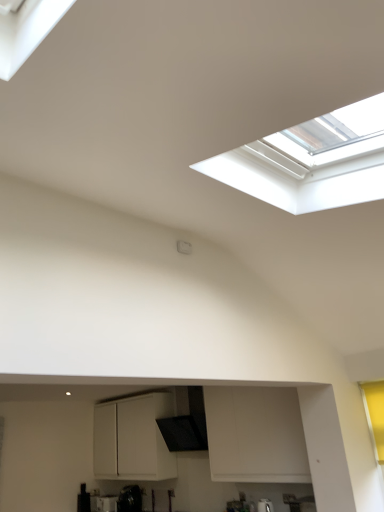
What do you see at coordinates (186, 425) in the screenshot?
I see `black textured exhaust hood at center` at bounding box center [186, 425].

Identify the location of black textured exhaust hood at center. This screenshot has height=512, width=384. (186, 425).

The height and width of the screenshot is (512, 384). What are the coordinates of `black glossy kettle at lower center` in the screenshot? It's located at (130, 499).

Measure the distance from black glossy kettle at lower center to black textured exhaust hood at center.

1.00 meters.

Could you tell me if black glossy kettle at lower center is facing black textured exhaust hood at center?

No, black glossy kettle at lower center is not turned towards black textured exhaust hood at center.

Which of these two, black glossy kettle at lower center or black textured exhaust hood at center, is wider?

black textured exhaust hood at center is wider.

Can you confirm if black glossy kettle at lower center is smaller than black textured exhaust hood at center?

Correct, black glossy kettle at lower center occupies less space than black textured exhaust hood at center.

Considering the sizes of objects white matte cabinet at center and black glossy kettle at lower center in the image provided, who is smaller, white matte cabinet at center or black glossy kettle at lower center?

With smaller size is black glossy kettle at lower center.

Find the location of a particular element. appliance behind the white matte cabinet at center is located at coordinates (130, 499).

Would you say white matte cabinet at center is outside black glossy kettle at lower center?

Yes, white matte cabinet at center is located beyond the bounds of black glossy kettle at lower center.

Could you tell me if black textured exhaust hood at center is turned towards white matte cabinet at center?

No, black textured exhaust hood at center does not turn towards white matte cabinet at center.

Is black textured exhaust hood at center completely or partially outside of white matte cabinet at center?

Indeed, black textured exhaust hood at center is completely outside white matte cabinet at center.

The width and height of the screenshot is (384, 512). Identify the location of cabinetry behind the black textured exhaust hood at center. (133, 439).

Does point (202, 420) lie behind point (135, 433)?

No, it is not.

Measure the distance between white matte cabinet at center and black textured exhaust hood at center.

A distance of 18.45 inches exists between white matte cabinet at center and black textured exhaust hood at center.

Considering the sizes of objects white matte cabinet at center and black textured exhaust hood at center in the image provided, who is thinner, white matte cabinet at center or black textured exhaust hood at center?

black textured exhaust hood at center is thinner.

From the image's perspective, between white matte cabinet at center and black textured exhaust hood at center, who is located below?

white matte cabinet at center.

In terms of size, does white matte cabinet at center appear bigger or smaller than black textured exhaust hood at center?

In the image, white matte cabinet at center appears to be larger than black textured exhaust hood at center.

Which object is thinner, black glossy kettle at lower center or white matte cabinet at center?

black glossy kettle at lower center.

Is black glossy kettle at lower center positioned behind white matte cabinet at center?

Yes, black glossy kettle at lower center is behind white matte cabinet at center.

Is white matte cabinet at center inside black glossy kettle at lower center?

Actually, white matte cabinet at center is outside black glossy kettle at lower center.

Is point (129, 490) farther from camera compared to point (128, 456)?

That is False.

Between black textured exhaust hood at center and black glossy kettle at lower center, which one is positioned behind?

black glossy kettle at lower center.

Consider the image. From the image's perspective, between black textured exhaust hood at center and black glossy kettle at lower center, which one is located above?

black textured exhaust hood at center appears higher in the image.

Considering the sizes of black textured exhaust hood at center and black glossy kettle at lower center in the image, is black textured exhaust hood at center wider or thinner than black glossy kettle at lower center?

black textured exhaust hood at center is wider than black glossy kettle at lower center.

The image size is (384, 512). I want to click on exhaust hood that appears above the black glossy kettle at lower center (from the image's perspective), so click(186, 425).

Locate an element on the screen. appliance below the white matte cabinet at center (from a real-world perspective) is located at coordinates (130, 499).

Estimate the real-world distances between objects in this image. Which object is closer to black textured exhaust hood at center, white matte cabinet at center or black glossy kettle at lower center?

The object closer to black textured exhaust hood at center is white matte cabinet at center.

When comparing their distances from black textured exhaust hood at center, does black glossy kettle at lower center or white matte cabinet at center seem further?

black glossy kettle at lower center is further to black textured exhaust hood at center.

Estimate the real-world distances between objects in this image. Which object is further from black glossy kettle at lower center, black textured exhaust hood at center or white matte cabinet at center?

Among the two, black textured exhaust hood at center is located further to black glossy kettle at lower center.

From the image, which object appears to be nearer to black glossy kettle at lower center, white matte cabinet at center or black textured exhaust hood at center?

white matte cabinet at center lies closer to black glossy kettle at lower center than the other object.

Estimate the real-world distances between objects in this image. Which object is further from white matte cabinet at center, black textured exhaust hood at center or black glossy kettle at lower center?

Based on the image, black glossy kettle at lower center appears to be further to white matte cabinet at center.

Considering their positions, is black glossy kettle at lower center positioned closer to white matte cabinet at center than black textured exhaust hood at center?

black textured exhaust hood at center is positioned closer to the anchor white matte cabinet at center.

Locate an element on the screen. The height and width of the screenshot is (512, 384). cabinetry between black textured exhaust hood at center and black glossy kettle at lower center in the up-down direction is located at coordinates (133, 439).